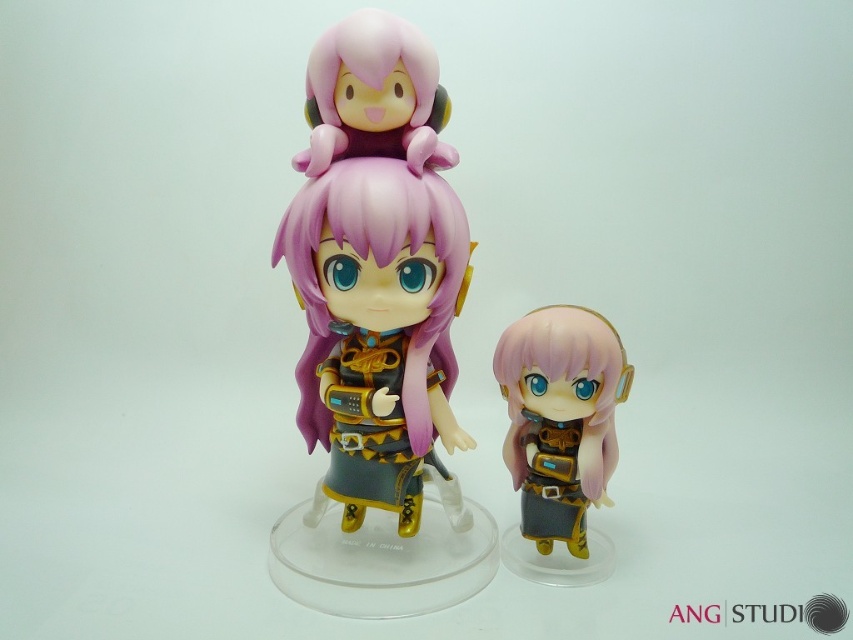
Question: Considering the relative positions of matte black figure at center and purple matte hair at center in the image provided, where is matte black figure at center located with respect to purple matte hair at center?

Choices:
 (A) right
 (B) left

Answer: (A)

Question: Does matte black figure at center appear under purple matte hair at center?

Choices:
 (A) no
 (B) yes

Answer: (B)

Question: Can you confirm if matte black figure at center is thinner than purple matte hair at center?

Choices:
 (A) yes
 (B) no

Answer: (A)